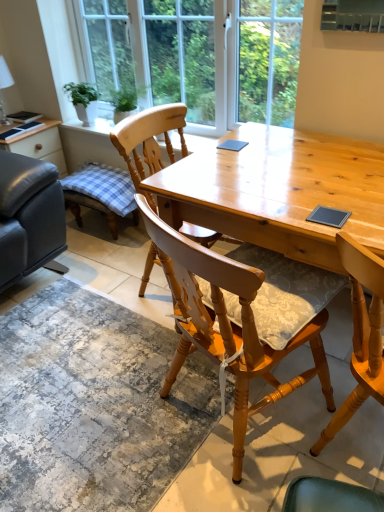
Question: Would you say wooden chair with cushion at center, the second chair from the back, is to the left or to the right of light brown wooden desk at center in the picture?

Choices:
 (A) right
 (B) left

Answer: (B)

Question: From the image's perspective, is wooden chair with cushion at center, the second chair from the back, positioned above or below light brown wooden desk at center?

Choices:
 (A) below
 (B) above

Answer: (A)

Question: Considering the real-world distances, which object is closest to the light brown wooden desk at center?

Choices:
 (A) green leafy plant in white pot at upper left
 (B) clear glass window at upper center
 (C) textured gray rug at lower center
 (D) wooden chair at center, the 2th chair in the front-to-back sequence
 (E) matte black leather couch at left

Answer: (D)

Question: Which is nearer to the green leafy plant in white pot at upper left?

Choices:
 (A) textured gray rug at lower center
 (B) wooden chair with cushion at center, which appears as the 1th chair when viewed from the front
 (C) clear glass window at upper center
 (D) matte black leather couch at left
 (E) wooden chair at center, which is counted as the 1th chair, starting from the back

Answer: (D)